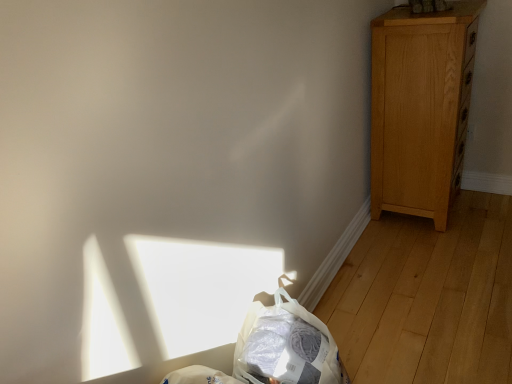
Question: Considering their positions, is translucent plastic bag at lower center located in front of or behind light brown wood dresser at right?

Choices:
 (A) front
 (B) behind

Answer: (A)

Question: From their relative heights in the image, would you say translucent plastic bag at lower center is taller or shorter than light brown wood dresser at right?

Choices:
 (A) short
 (B) tall

Answer: (A)

Question: Considering the positions of point (305, 332) and point (413, 82), is point (305, 332) closer or farther from the camera than point (413, 82)?

Choices:
 (A) closer
 (B) farther

Answer: (A)

Question: Is light brown wood dresser at right taller or shorter than translucent plastic bag at lower center?

Choices:
 (A) tall
 (B) short

Answer: (A)

Question: Does point (460, 91) appear closer or farther from the camera than point (290, 380)?

Choices:
 (A) closer
 (B) farther

Answer: (B)

Question: In the image, is light brown wood dresser at right on the left side or the right side of translucent plastic bag at lower center?

Choices:
 (A) left
 (B) right

Answer: (B)

Question: Is light brown wood dresser at right spatially inside translucent plastic bag at lower center, or outside of it?

Choices:
 (A) outside
 (B) inside

Answer: (A)